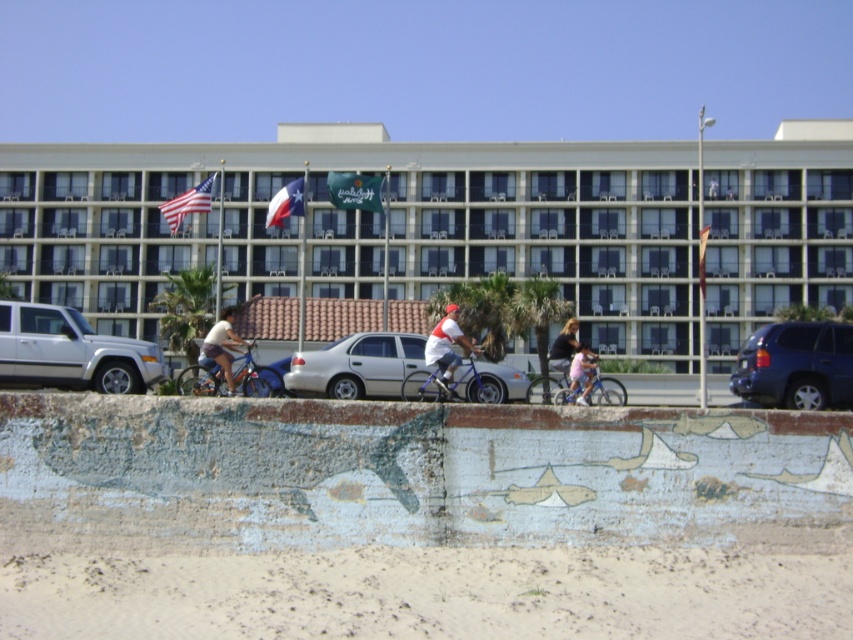
You are standing at the beach and see the matte blue shorts at center and the polyester texas flag at center. Which object is nearer to you?

The matte blue shorts at center is closer to the viewer than the polyester texas flag at center.

You are a pedestrian standing on the beach path. You see a silver metallic car at center and a matte blue shorts at center. Which object is closer to the ground?

Result: The silver metallic car at center is located below matte blue shorts at center, so it is closer to the ground.

You are a photographer trying to capture the scene at the beachfront. You notice the matte blue shorts at center and the polyester texas flag at center. Which object would require a wider lens to capture in full frame?

The polyester texas flag at center would require a wider lens because its width is greater than the matte blue shorts at center.